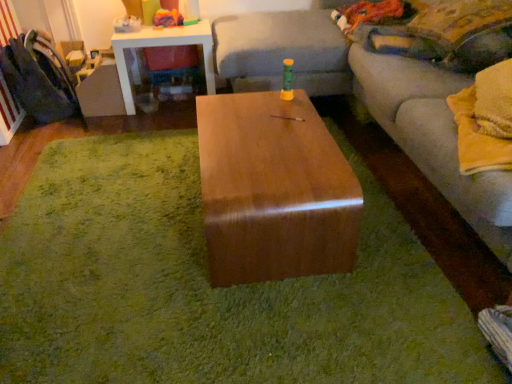
Identify the location of vacant space underneath rubberized plastic toy at upper left (from a real-world perspective). The image size is (512, 384). (173, 26).